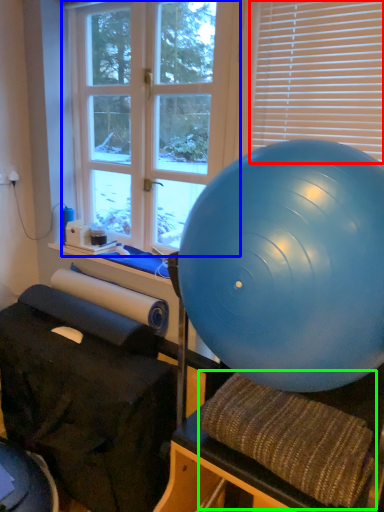
Question: Which is farther away from blind (highlighted by a red box)? window (highlighted by a blue box) or bean bag chair (highlighted by a green box)?

Choices:
 (A) window
 (B) bean bag chair

Answer: (B)